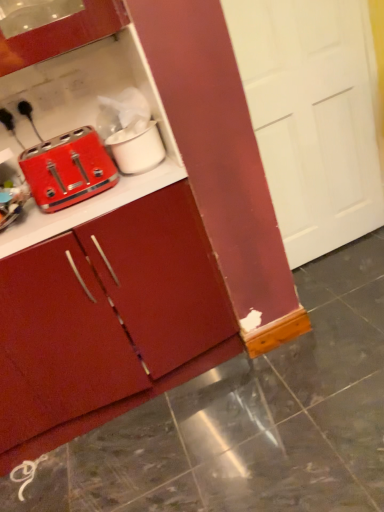
The height and width of the screenshot is (512, 384). I want to click on free area in between matte red cabinet at center and white glossy tile at lower left, so click(x=121, y=441).